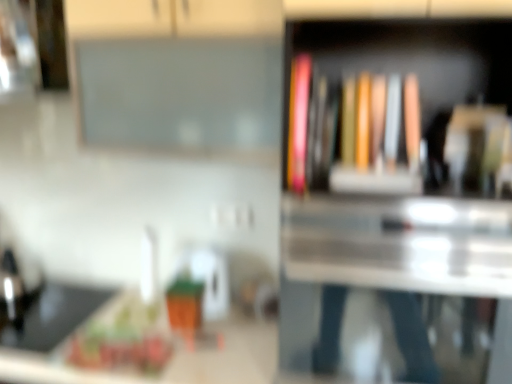
Question: Would you consider white glossy counter top at lower left to be distant from matte hardcover book at center, positioned as the first book in right-to-left order?

Choices:
 (A) no
 (B) yes

Answer: (A)

Question: Considering the relative positions of white glossy counter top at lower left and matte hardcover book at center, positioned as the first book in right-to-left order, in the image provided, is white glossy counter top at lower left to the right of matte hardcover book at center, positioned as the first book in right-to-left order, from the viewer's perspective?

Choices:
 (A) no
 (B) yes

Answer: (A)

Question: Is white glossy counter top at lower left aimed at matte hardcover book at center, positioned as the first book in right-to-left order?

Choices:
 (A) yes
 (B) no

Answer: (B)

Question: Is white glossy counter top at lower left thinner than matte hardcover book at center, positioned as the first book in right-to-left order?

Choices:
 (A) yes
 (B) no

Answer: (B)

Question: Can you confirm if white glossy counter top at lower left is wider than matte hardcover book at center, positioned as the first book in right-to-left order?

Choices:
 (A) yes
 (B) no

Answer: (A)

Question: In terms of height, does white glossy counter top at lower left look taller or shorter compared to black matte sink at lower left?

Choices:
 (A) short
 (B) tall

Answer: (B)

Question: From the image's perspective, is white glossy counter top at lower left positioned above or below black matte sink at lower left?

Choices:
 (A) above
 (B) below

Answer: (B)

Question: In the image, is white glossy counter top at lower left on the left side or the right side of black matte sink at lower left?

Choices:
 (A) right
 (B) left

Answer: (A)

Question: In terms of width, does white glossy counter top at lower left look wider or thinner when compared to black matte sink at lower left?

Choices:
 (A) wide
 (B) thin

Answer: (A)

Question: Is matte pink book at upper right, the second book viewed from the right, inside the boundaries of white glossy counter top at lower left, or outside?

Choices:
 (A) inside
 (B) outside

Answer: (B)

Question: In terms of size, does matte pink book at upper right, the second book viewed from the right, appear bigger or smaller than white glossy counter top at lower left?

Choices:
 (A) small
 (B) big

Answer: (A)

Question: Considering the positions of point (301, 125) and point (40, 377), is point (301, 125) closer or farther from the camera than point (40, 377)?

Choices:
 (A) farther
 (B) closer

Answer: (B)

Question: Is matte pink book at upper right, the first book from the left, to the left or to the right of white glossy counter top at lower left in the image?

Choices:
 (A) right
 (B) left

Answer: (A)

Question: From a real-world perspective, is matte pink book at upper right, the first book from the left, positioned above or below white glossy kettle at center?

Choices:
 (A) above
 (B) below

Answer: (A)

Question: Relative to white glossy kettle at center, is matte pink book at upper right, the first book from the left, in front or behind?

Choices:
 (A) behind
 (B) front

Answer: (B)